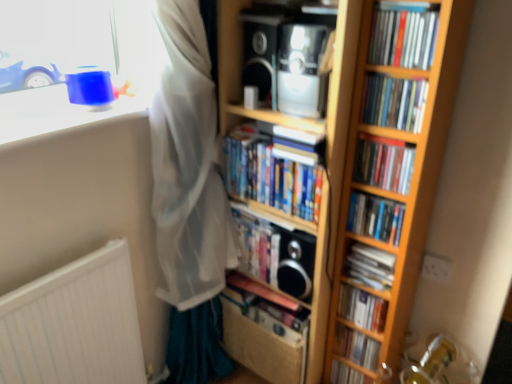
The height and width of the screenshot is (384, 512). Identify the location of free space above blue plastic toy at upper left (from a real-world perspective). (59, 114).